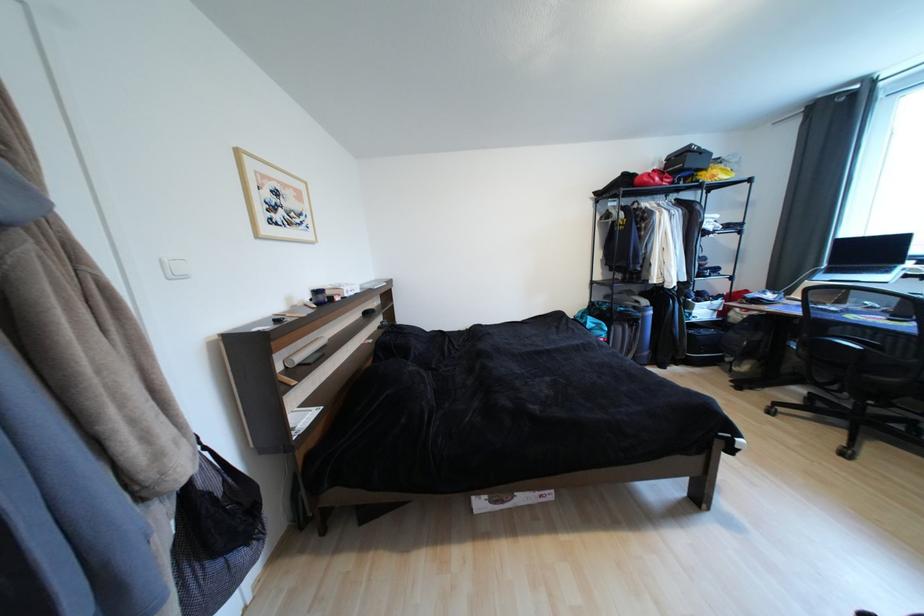
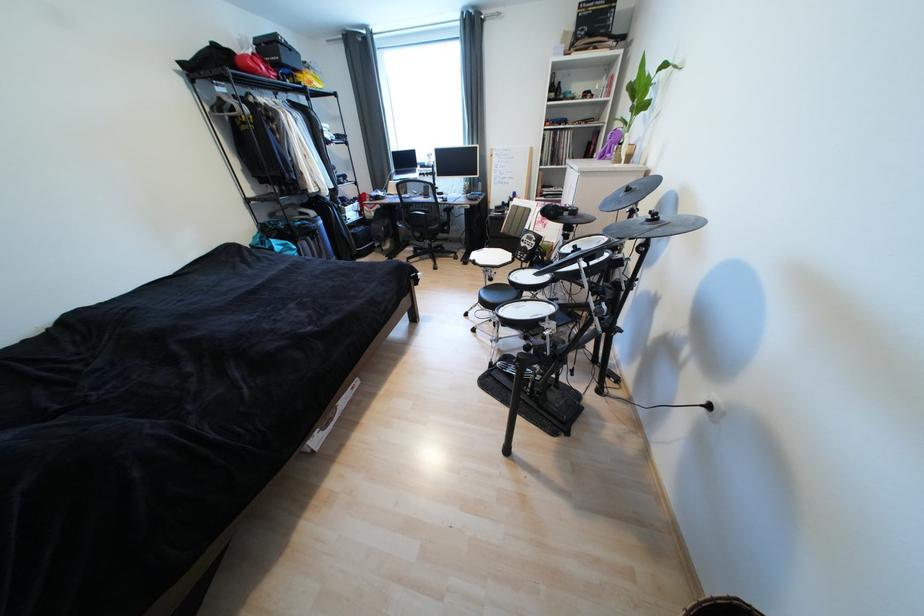
In the second image, find the point that corresponds to (x=696, y=171) in the first image.

(294, 68)